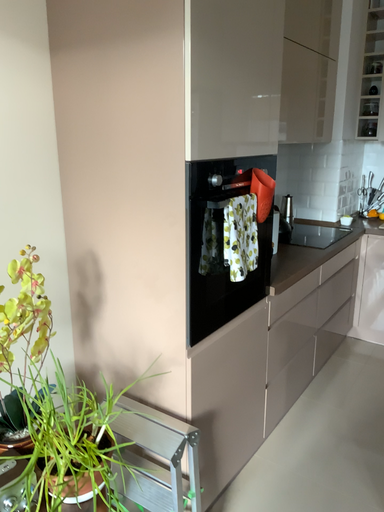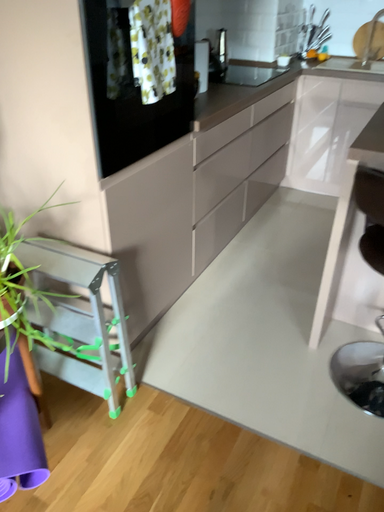
Question: How did the camera likely rotate when shooting the video?

Choices:
 (A) rotated upward
 (B) rotated downward

Answer: (B)